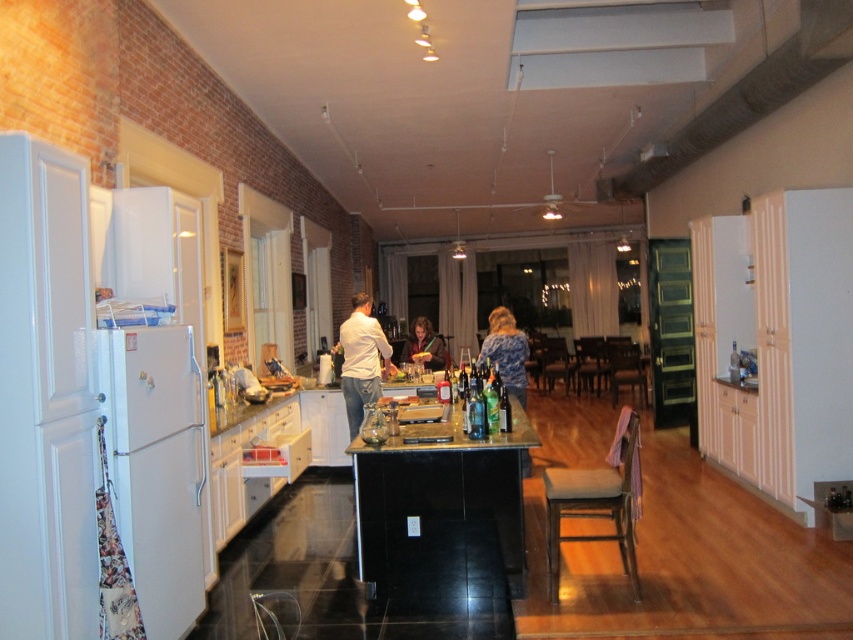
You are planning to place a rectangular box that is 2 meters wide on the floor. You see the brown cushioned stool at lower center and the metallic silver counter top at center. Which surface can accommodate the box based on their widths?

The metallic silver counter top at center has a greater width than the brown cushioned stool at lower center, so the box can be placed on the metallic silver counter top at center if its width is sufficient. However, the question mentions placing the box on the floor, so neither the stool nor the countertop are suitable surfaces for floor placement. Please check the floor dimensions instead.

You are standing in the kitchen and want to move from point A to point B. Point A is at coordinate point (x=345, y=346) and point B is at coordinate point (x=426, y=449). Which point is closer to you when you are facing the kitchen?

Point A at coordinate point (x=345, y=346) is closer to you because it is further to the viewer than point B at coordinate point (x=426, y=449).

You are organizing a charity event and need to decide which item to place on a narrow shelf that can only accommodate items narrower than the other. Given the blue textured sweater at center and the matte brown hair at center, which item should you choose?

The blue textured sweater at center should be chosen because its width is less than the matte brown hair at center, making it suitable for the narrow shelf.